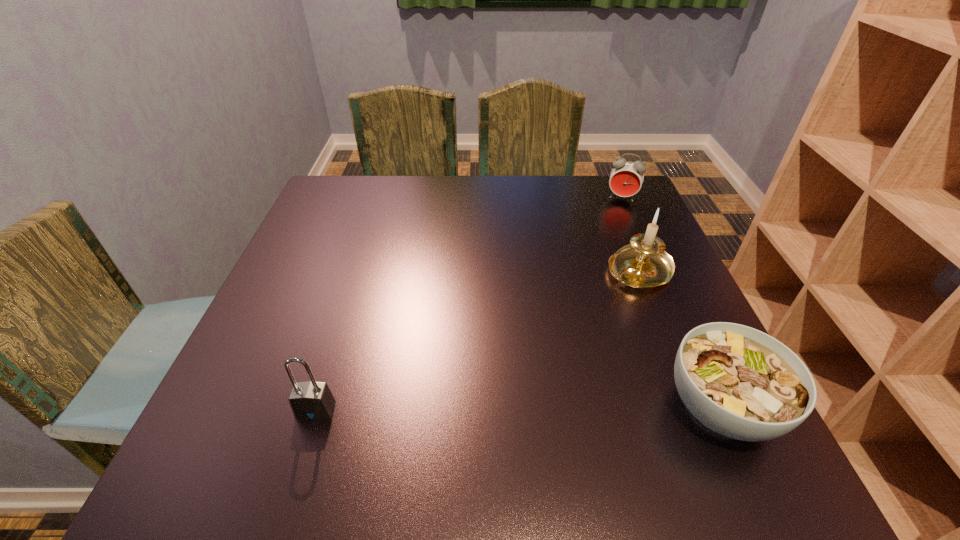
Identify which object is located as the nearest to the padlock. Please provide its 2D coordinates. Your answer should be formatted as a tuple, i.e. [(x, y)], where the tuple contains the x and y coordinates of a point satisfying the conditions above.

[(740, 382)]